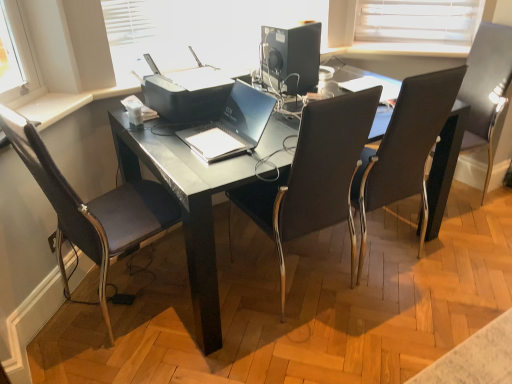
Find the location of a particular element. vacant area that is in front of dark brown leather chair at left, the 4th chair positioned from the right is located at coordinates (123, 353).